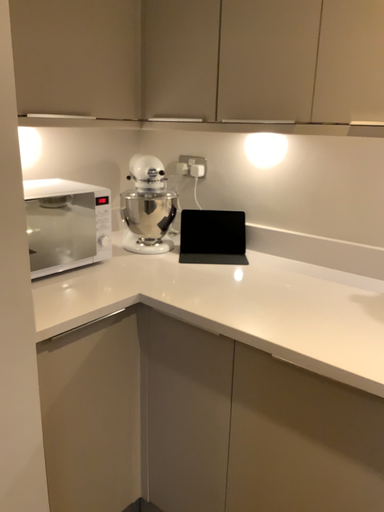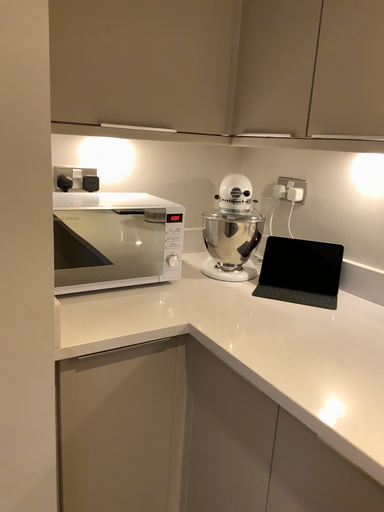
Question: Which way did the camera rotate in the video?

Choices:
 (A) rotated left
 (B) rotated right

Answer: (A)